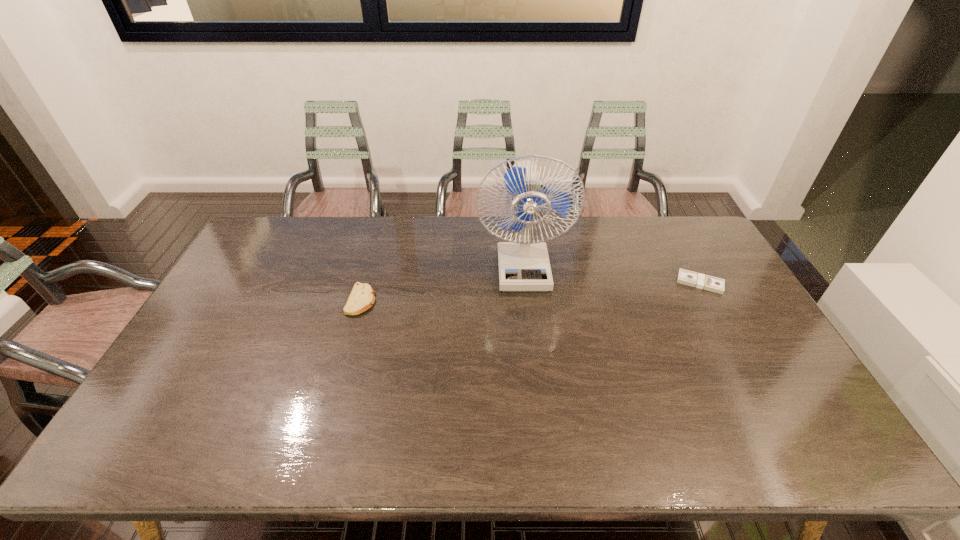
You are a GUI agent. You are given a task and a screenshot of the screen. Output one action in this format:
    pyautogui.click(x=<x>, y=<y>)
    Task: Click on the free spot between the dollar and the fan
    This screenshot has height=540, width=960.
    Given the screenshot: What is the action you would take?
    pyautogui.click(x=612, y=275)

Image resolution: width=960 pixels, height=540 pixels. Find the location of `free spot between the shortest object and the fan`. free spot between the shortest object and the fan is located at coordinates (612, 275).

You are a GUI agent. You are given a task and a screenshot of the screen. Output one action in this format:
    pyautogui.click(x=<x>, y=<y>)
    Task: Click on the free area in between the rightmost object and the tallest object
    
    Given the screenshot: What is the action you would take?
    pyautogui.click(x=612, y=275)

Find the location of a particular element. The width and height of the screenshot is (960, 540). vacant space that's between the shortest object and the pita bread is located at coordinates (531, 292).

Where is `vacant region between the second object from left to right and the leftmost object`? vacant region between the second object from left to right and the leftmost object is located at coordinates (442, 284).

Image resolution: width=960 pixels, height=540 pixels. In order to click on free area in between the second object from right to left and the dollar in this screenshot , I will do [612, 275].

You are a GUI agent. You are given a task and a screenshot of the screen. Output one action in this format:
    pyautogui.click(x=<x>, y=<y>)
    Task: Click on the closest object relative to the leftmost object
    The image size is (960, 540).
    Given the screenshot: What is the action you would take?
    pyautogui.click(x=523, y=265)

The height and width of the screenshot is (540, 960). What are the coordinates of `object that stands as the closest to the leftmost object` in the screenshot? It's located at (x=523, y=265).

Locate an element on the screen. The width and height of the screenshot is (960, 540). vacant space that satisfies the following two spatial constraints: 1. on the front-facing side of the shortest object; 2. on the left side of the fan is located at coordinates (524, 283).

Locate an element on the screen. vacant point that satisfies the following two spatial constraints: 1. on the front-facing side of the fan; 2. on the left side of the dollar is located at coordinates (524, 283).